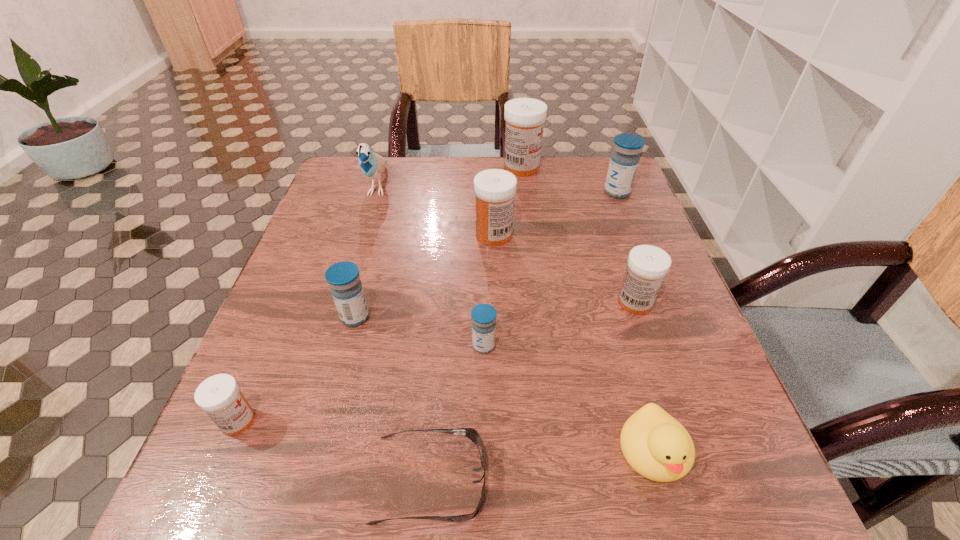
Where is `duckling present at the right edge`? This screenshot has height=540, width=960. duckling present at the right edge is located at coordinates (658, 447).

The image size is (960, 540). I want to click on object present at the far left corner, so tap(372, 165).

Locate an element on the screen. This screenshot has height=540, width=960. object positioned at the far right corner is located at coordinates (624, 161).

Identify the location of object present at the near right corner. The height and width of the screenshot is (540, 960). (658, 447).

You are a GUI agent. You are given a task and a screenshot of the screen. Output one action in this format:
    pyautogui.click(x=<x>, y=<y>)
    Task: Click on the vacant area at the far edge of the desktop
    Image resolution: width=960 pixels, height=540 pixels.
    Given the screenshot: What is the action you would take?
    pyautogui.click(x=476, y=195)

In order to click on vacant space at the left edge in this screenshot , I will do `click(343, 205)`.

Find the location of a particular element. The width and height of the screenshot is (960, 540). vacant space at the right edge of the desktop is located at coordinates (677, 354).

Find the location of a particular element. vacant space at the far left corner of the desktop is located at coordinates (375, 180).

You are a GUI agent. You are given a task and a screenshot of the screen. Output one action in this format:
    pyautogui.click(x=<x>, y=<y>)
    Task: Click on the vacant space at the near left corner of the desktop
    The width and height of the screenshot is (960, 540).
    Given the screenshot: What is the action you would take?
    pyautogui.click(x=298, y=503)

Find the location of a particular element. vacant space at the far right corner of the desktop is located at coordinates (591, 163).